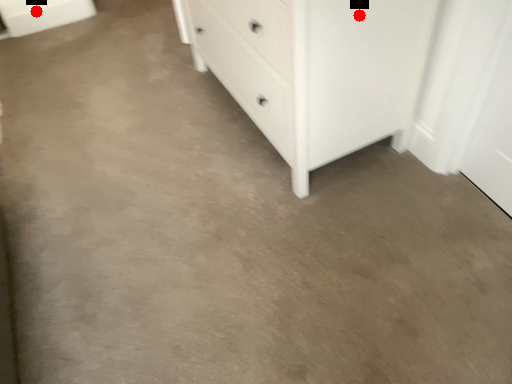
Question: Two points are circled on the image, labeled by A and B beside each circle. Which of the following is the closest to the observer?

Choices:
 (A) A is closer
 (B) B is closer

Answer: (A)